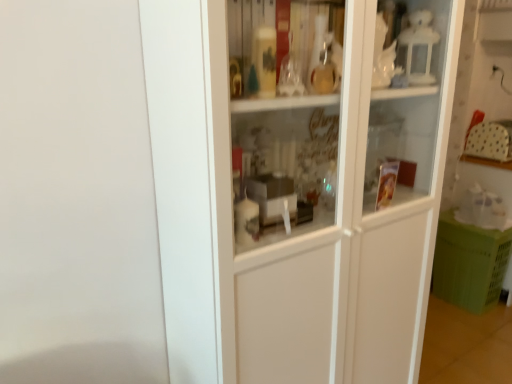
Describe the element at coordinates (469, 263) in the screenshot. The image size is (512, 384). I see `green plastic crate at lower right` at that location.

Where is `green plastic crate at lower right`? This screenshot has height=384, width=512. green plastic crate at lower right is located at coordinates (469, 263).

Describe the element at coordinates (297, 183) in the screenshot. I see `white glossy cupboard at center` at that location.

Where is `white glossy cupboard at center`? Image resolution: width=512 pixels, height=384 pixels. white glossy cupboard at center is located at coordinates (297, 183).

In order to click on green plastic crate at lower right in this screenshot , I will do `click(469, 263)`.

Is white glossy cupboard at center to the left of green plastic crate at lower right from the viewer's perspective?

Indeed, white glossy cupboard at center is positioned on the left side of green plastic crate at lower right.

Which object is closer to the camera, white glossy cupboard at center or green plastic crate at lower right?

white glossy cupboard at center.

Does point (403, 260) come in front of point (435, 262)?

Yes.

Consider the image. From the image's perspective, between white glossy cupboard at center and green plastic crate at lower right, who is located below?

green plastic crate at lower right, from the image's perspective.

From a real-world perspective, is white glossy cupboard at center above or below green plastic crate at lower right?

In terms of real-world spatial position, white glossy cupboard at center is above green plastic crate at lower right.

Based on the photo, considering the sizes of objects white glossy cupboard at center and green plastic crate at lower right in the image provided, who is wider, white glossy cupboard at center or green plastic crate at lower right?

With larger width is white glossy cupboard at center.

Does white glossy cupboard at center have a lesser height compared to green plastic crate at lower right?

No, white glossy cupboard at center is not shorter than green plastic crate at lower right.

Can you confirm if white glossy cupboard at center is bigger than green plastic crate at lower right?

Indeed, white glossy cupboard at center has a larger size compared to green plastic crate at lower right.

Is white glossy cupboard at center outside of green plastic crate at lower right?

Yes, white glossy cupboard at center is not within green plastic crate at lower right.

In the scene shown: Is white glossy cupboard at center in contact with green plastic crate at lower right?

white glossy cupboard at center is not next to green plastic crate at lower right, and they're not touching.

Is white glossy cupboard at center facing towards green plastic crate at lower right?

No, white glossy cupboard at center is not aimed at green plastic crate at lower right.

How many degrees apart are the facing directions of white glossy cupboard at center and green plastic crate at lower right?

93.2 degrees.

You are a GUI agent. You are given a task and a screenshot of the screen. Output one action in this format:
    pyautogui.click(x=<x>, y=<y>)
    Task: Click on the cupboard in front of the green plastic crate at lower right
    The width and height of the screenshot is (512, 384).
    Given the screenshot: What is the action you would take?
    pyautogui.click(x=297, y=183)

Is green plastic crate at lower right at the right side of white glossy cupboard at center?

Indeed, green plastic crate at lower right is positioned on the right side of white glossy cupboard at center.

Considering the positions of objects green plastic crate at lower right and white glossy cupboard at center in the image provided, who is behind, green plastic crate at lower right or white glossy cupboard at center?

green plastic crate at lower right is more distant.

Considering the points (488, 292) and (341, 224), which point is in front, point (488, 292) or point (341, 224)?

The point (341, 224) is more forward.

From the image's perspective, is green plastic crate at lower right above or below white glossy cupboard at center?

From the image's perspective, green plastic crate at lower right appears below white glossy cupboard at center.

From a real-world perspective, which object stands above the other?

From a 3D spatial view, white glossy cupboard at center is above.

Consider the image. Does green plastic crate at lower right have a greater width compared to white glossy cupboard at center?

No.

Does green plastic crate at lower right have a lesser height compared to white glossy cupboard at center?

Indeed, green plastic crate at lower right has a lesser height compared to white glossy cupboard at center.

Consider the image. Which of these two, green plastic crate at lower right or white glossy cupboard at center, is bigger?

With larger size is white glossy cupboard at center.

Is green plastic crate at lower right surrounding white glossy cupboard at center?

Actually, white glossy cupboard at center is outside green plastic crate at lower right.

Is there a large distance between green plastic crate at lower right and white glossy cupboard at center?

Absolutely, green plastic crate at lower right is distant from white glossy cupboard at center.

Is green plastic crate at lower right facing towards white glossy cupboard at center?

Yes.

What's the angular difference between green plastic crate at lower right and white glossy cupboard at center's facing directions?

There is a 93.2-degree angle between the facing directions of green plastic crate at lower right and white glossy cupboard at center.

The image size is (512, 384). I want to click on cupboard in front of the green plastic crate at lower right, so click(297, 183).

Locate an element on the screen. Image resolution: width=512 pixels, height=384 pixels. cupboard in front of the green plastic crate at lower right is located at coordinates pyautogui.click(x=297, y=183).

The image size is (512, 384). I want to click on cupboard above the green plastic crate at lower right (from a real-world perspective), so click(297, 183).